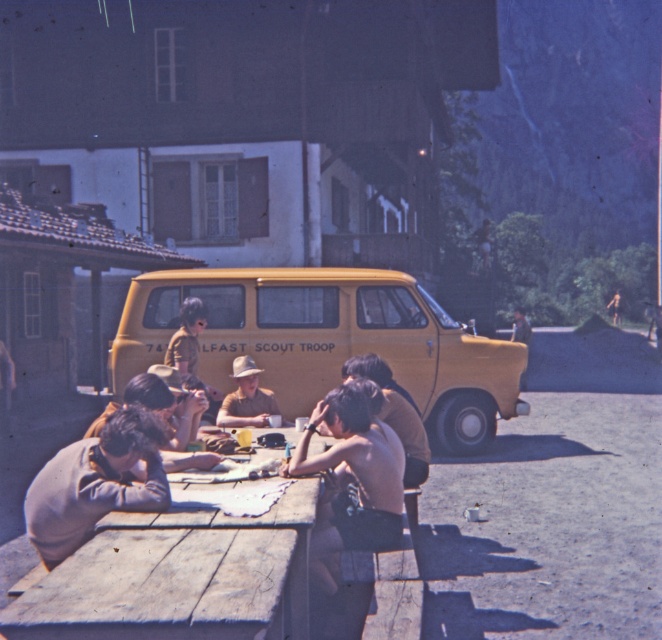
You are trying to determine if the yellow matte van at center can fit through a low clearance tunnel that only allows vehicles shorter than the light brown sweater at lower left. Can it pass?

The yellow matte van at center has a greater height compared to the light brown sweater at lower left, so it cannot pass through the tunnel since it exceeds the height limit.